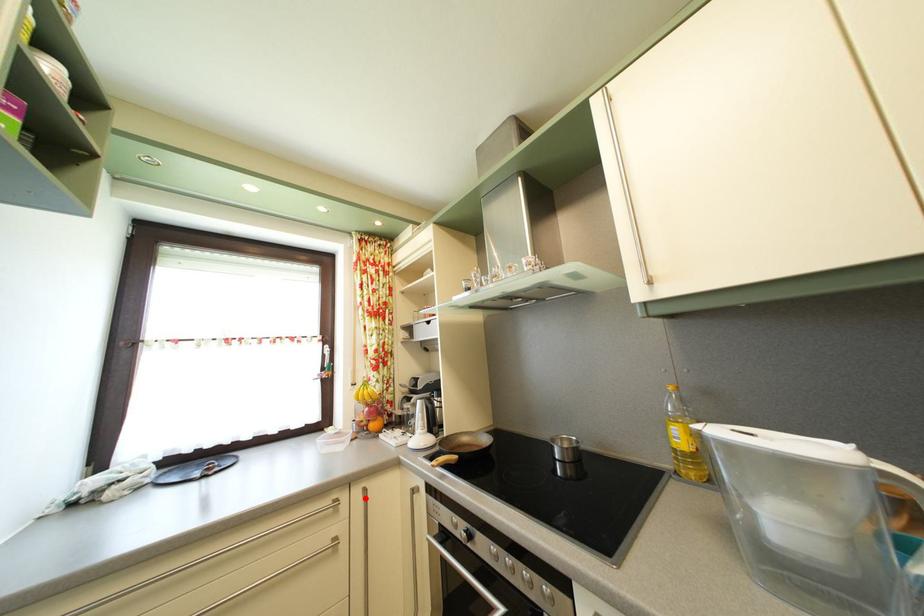
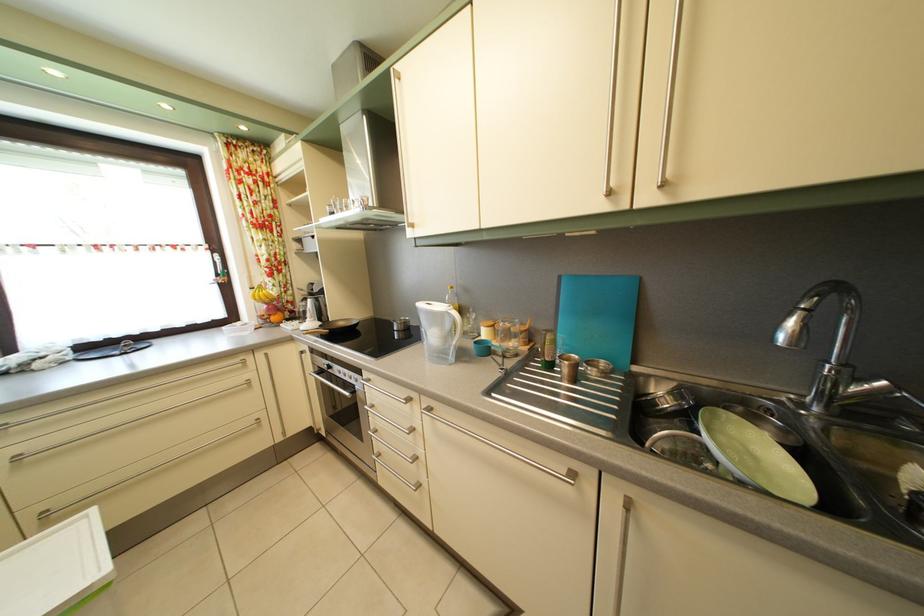
In the second image, find the point that corresponds to the highlighted location in the first image.

(268, 363)